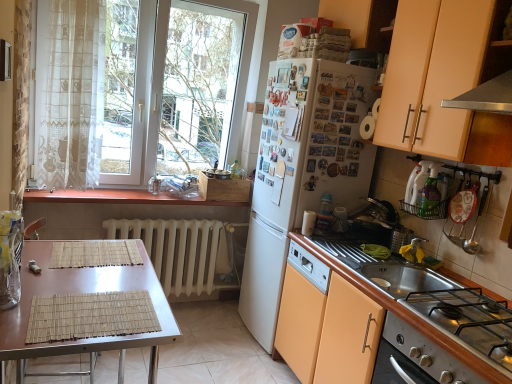
Locate an element on the screen. This screenshot has height=384, width=512. vacant area that lies to the right of clear glass jar at left is located at coordinates (44, 291).